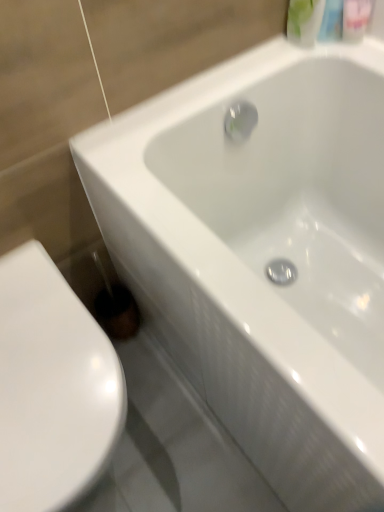
I want to click on free space to the left of green matte bottle at upper right, the first mouthwash when ordered from left to right, so click(249, 68).